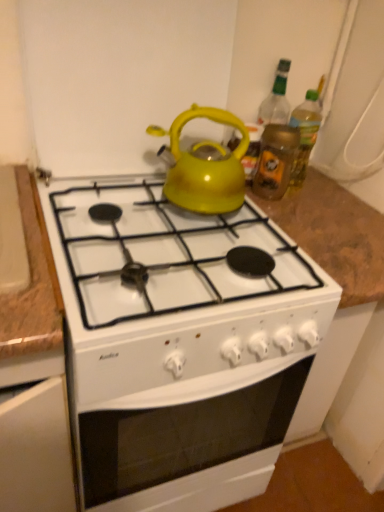
Question: Should I look upward or downward to see white glossy stove at center?

Choices:
 (A) down
 (B) up

Answer: (A)